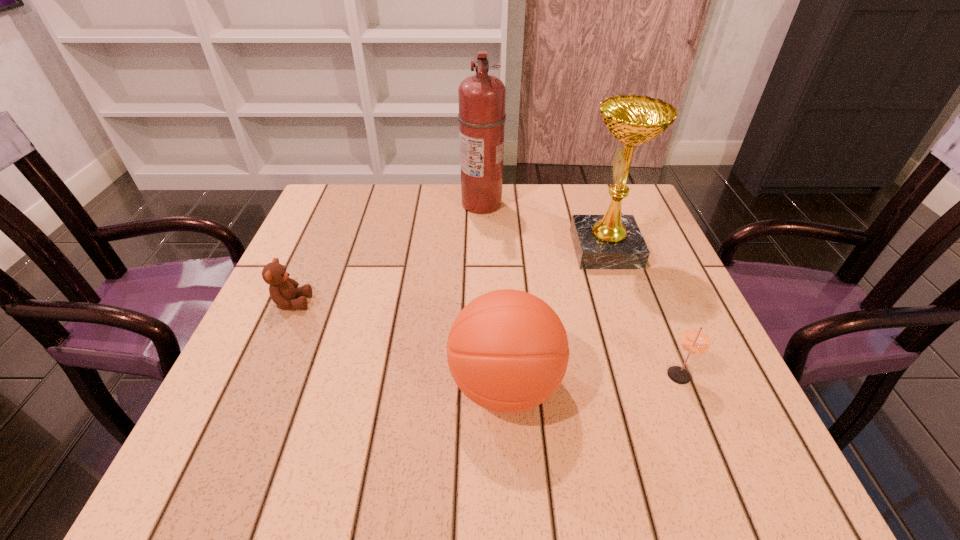
The width and height of the screenshot is (960, 540). I want to click on object present at the left edge, so click(x=283, y=290).

I want to click on award that is positioned at the right edge, so click(612, 241).

The height and width of the screenshot is (540, 960). Find the location of `straw located at the right edge`. straw located at the right edge is located at coordinates (695, 340).

Find the location of a particular element. The image size is (960, 540). object located at the far right corner is located at coordinates (612, 241).

Where is `free space at the far edge`? free space at the far edge is located at coordinates (442, 226).

The image size is (960, 540). What are the coordinates of `vacant area at the near edge` in the screenshot? It's located at [324, 480].

Where is `free region at the left edge of the desktop`? The height and width of the screenshot is (540, 960). free region at the left edge of the desktop is located at coordinates (247, 353).

I want to click on free space at the right edge, so click(616, 289).

Where is `vacant space at the far left corner`? This screenshot has height=540, width=960. vacant space at the far left corner is located at coordinates (344, 221).

You are a GUI agent. You are given a task and a screenshot of the screen. Output one action in this format:
    pyautogui.click(x=<x>, y=<y>)
    Task: Click on the vacant area at the far right corner
    The width and height of the screenshot is (960, 540).
    Given the screenshot: What is the action you would take?
    pyautogui.click(x=638, y=210)